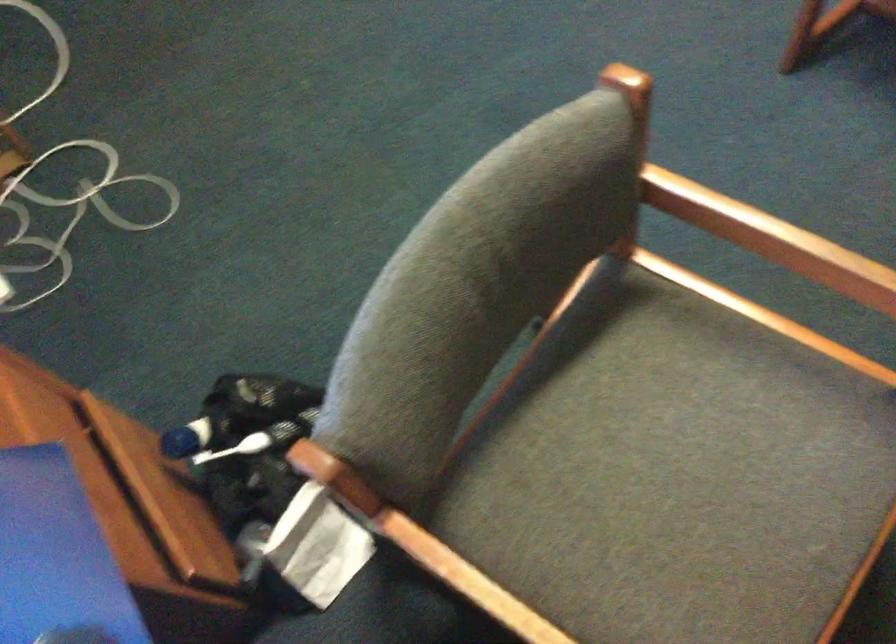
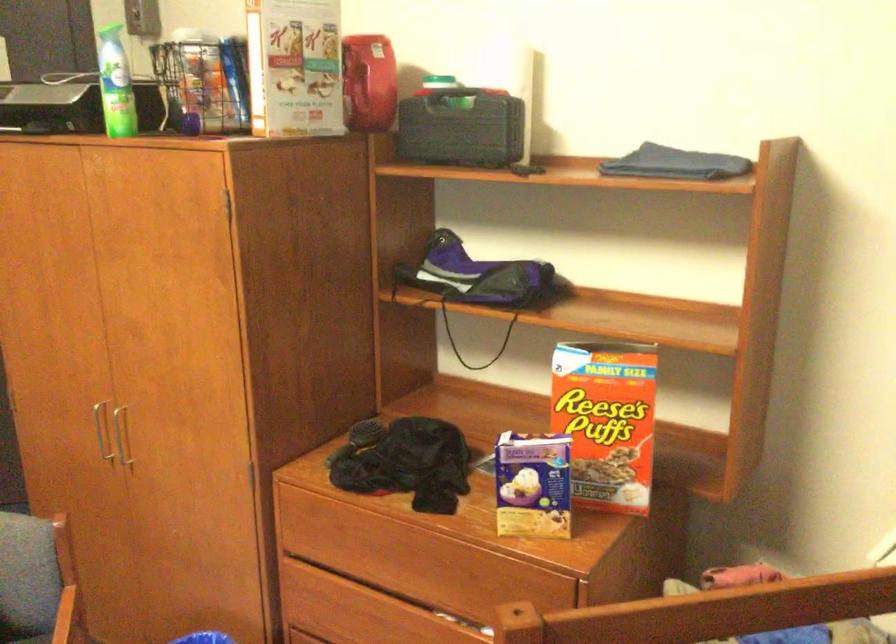
Based on the photo, based on the continuous images, in which direction is the camera rotating?

The camera rotated toward right-up.